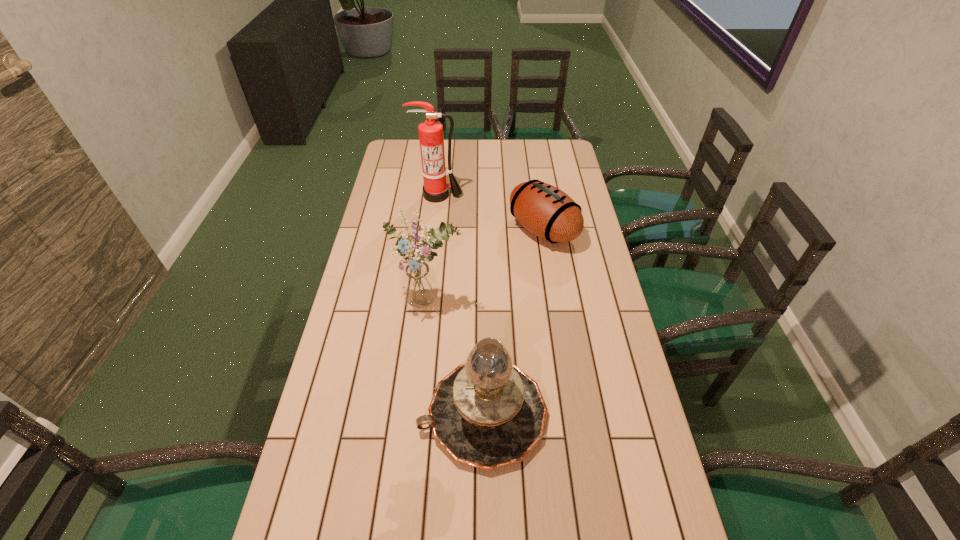
Locate an element on the screen. the farthest object is located at coordinates (431, 138).

Locate an element on the screen. The image size is (960, 540). the second nearest object is located at coordinates (418, 282).

Find the location of `the third tallest object`. the third tallest object is located at coordinates (487, 413).

This screenshot has width=960, height=540. What are the coordinates of `the nearest object` in the screenshot? It's located at (487, 413).

At what (x,y) coordinates should I click in order to perform the action: click on football (American). Please return your answer as a coordinate pair (x, y). Looking at the image, I should click on pyautogui.click(x=546, y=211).

Locate an element on the screen. The width and height of the screenshot is (960, 540). the third nearest object is located at coordinates [x=546, y=211].

Find the location of a particular element. free space located 0.330m at the nozzle of the fire extinguisher is located at coordinates (431, 259).

At what (x,y) coordinates should I click in order to perform the action: click on free location located 0.050m on the front-facing side of the second nearest object. Please return your answer as a coordinate pair (x, y). This screenshot has height=540, width=960. Looking at the image, I should click on (425, 333).

Locate an element on the screen. The width and height of the screenshot is (960, 540). vacant region located on the left of the nearest object is located at coordinates (324, 414).

The height and width of the screenshot is (540, 960). What are the coordinates of `vacant position located 0.160m on the left of the shortest object` in the screenshot? It's located at (468, 230).